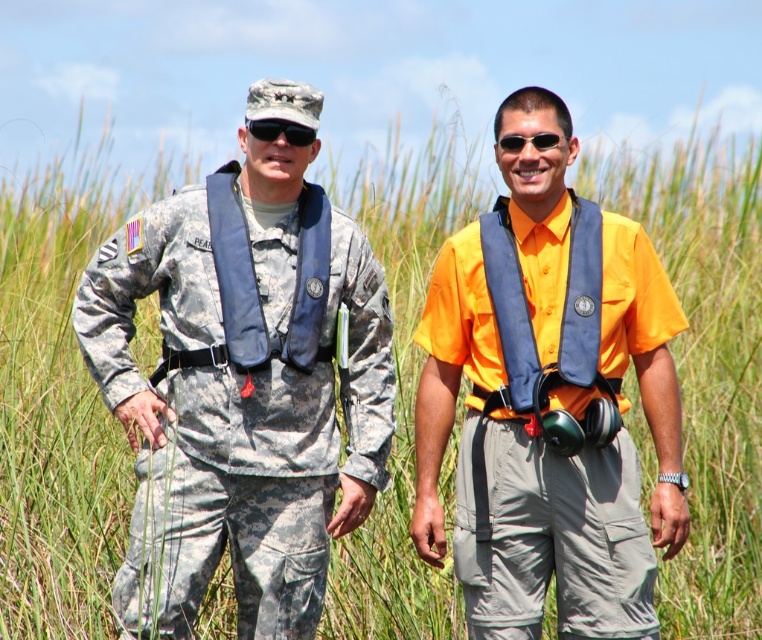
Question: Where is camouflage fabric uniform at left located in relation to blue fabric life vest at center in the image?

Choices:
 (A) right
 (B) left

Answer: (B)

Question: Which of these objects is positioned farthest from the blue fabric life vest at left?

Choices:
 (A) camouflage fabric uniform at left
 (B) black matte sunglasses at center
 (C) black matte sunglasses at upper center

Answer: (B)

Question: Which object appears closest to the camera in this image?

Choices:
 (A) blue fabric life vest at left
 (B) black matte sunglasses at upper center
 (C) black matte sunglasses at center
 (D) camouflage fabric uniform at left

Answer: (D)

Question: Is blue fabric life vest at center positioned before black matte sunglasses at center?

Choices:
 (A) yes
 (B) no

Answer: (A)

Question: Which is nearer to the camouflage fabric uniform at left?

Choices:
 (A) blue fabric life vest at center
 (B) black matte sunglasses at center
 (C) blue fabric life vest at left
 (D) yellow matte shirt at center

Answer: (C)

Question: Is camouflage fabric uniform at left to the left of black matte sunglasses at center from the viewer's perspective?

Choices:
 (A) no
 (B) yes

Answer: (B)